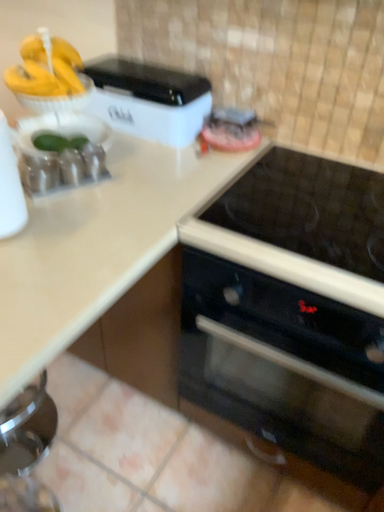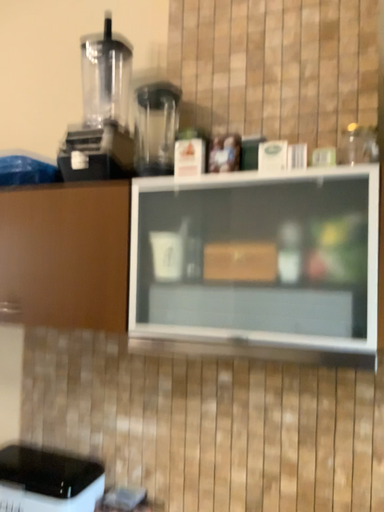
Question: Which way did the camera rotate in the video?

Choices:
 (A) rotated right
 (B) rotated left

Answer: (A)